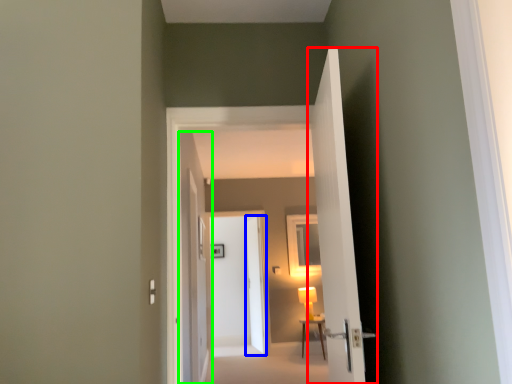
Question: Considering the real-world distances, which object is closest to door (highlighted by a red box)? door (highlighted by a blue box) or door (highlighted by a green box).

Choices:
 (A) door
 (B) door

Answer: (B)